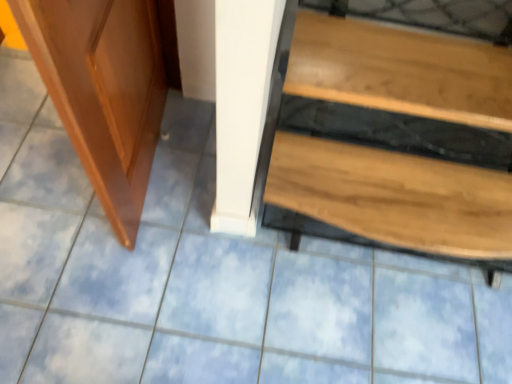
Question: From the image's perspective, is shiny brown wood screen door at left above or below wooden table at lower right?

Choices:
 (A) above
 (B) below

Answer: (A)

Question: Is shiny brown wood screen door at left in front of or behind wooden table at lower right in the image?

Choices:
 (A) front
 (B) behind

Answer: (A)

Question: Is point (128, 61) positioned closer to the camera than point (419, 193)?

Choices:
 (A) closer
 (B) farther

Answer: (A)

Question: From a real-world perspective, is wooden table at lower right positioned above or below shiny brown wood screen door at left?

Choices:
 (A) below
 (B) above

Answer: (A)

Question: Relative to shiny brown wood screen door at left, is wooden table at lower right in front or behind?

Choices:
 (A) behind
 (B) front

Answer: (A)

Question: Looking at their shapes, would you say wooden table at lower right is wider or thinner than shiny brown wood screen door at left?

Choices:
 (A) wide
 (B) thin

Answer: (A)

Question: Is wooden table at lower right taller or shorter than shiny brown wood screen door at left?

Choices:
 (A) short
 (B) tall

Answer: (A)